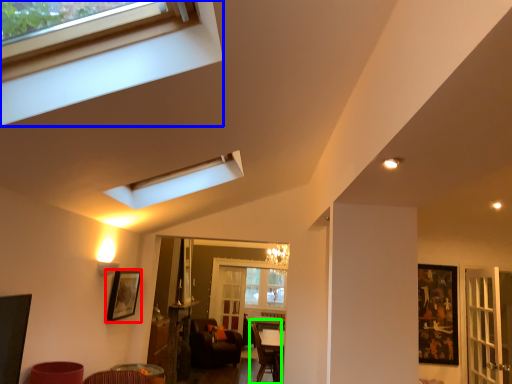
Question: Which is nearer to the picture frame (highlighted by a red box)? window (highlighted by a blue box) or armchair (highlighted by a green box).

Choices:
 (A) window
 (B) armchair

Answer: (B)